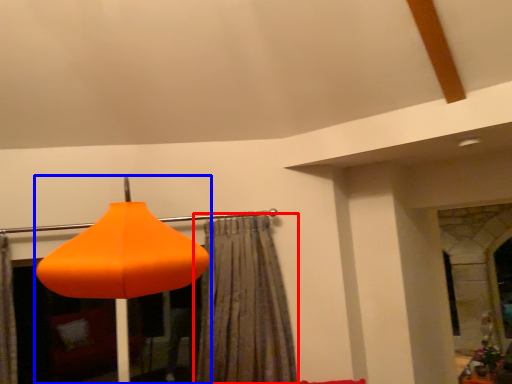
Question: Which object appears closest to the camera in this image, curtain (highlighted by a red box) or lamp (highlighted by a blue box)?

Choices:
 (A) curtain
 (B) lamp

Answer: (B)